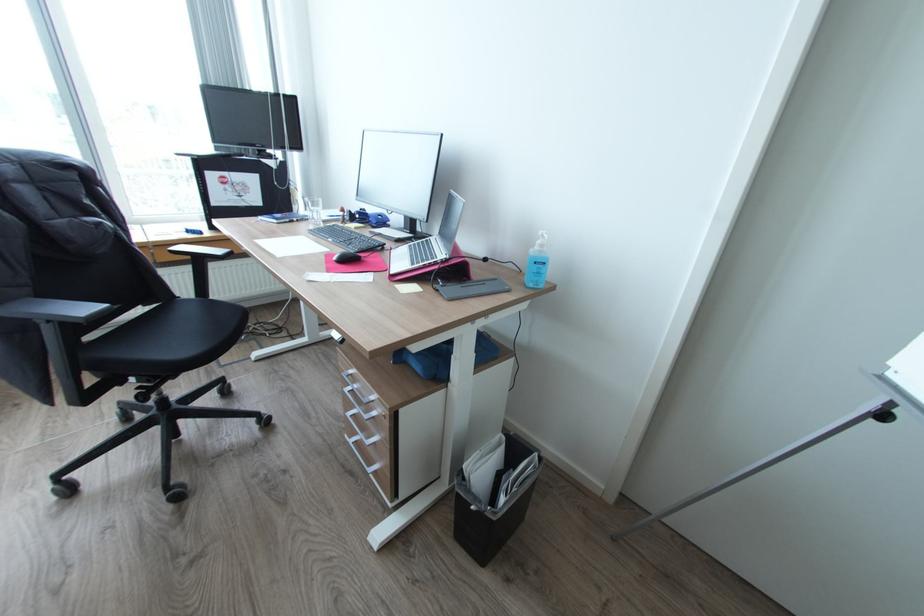
Where would you lift the blue tape dispenser? Please return your answer as a coordinate pair (x, y).

(369, 217)